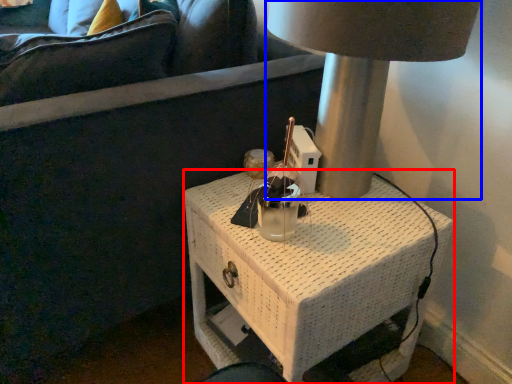
Question: Which object appears farthest to the camera in this image, nightstand (highlighted by a red box) or lamp (highlighted by a blue box)?

Choices:
 (A) nightstand
 (B) lamp

Answer: (A)